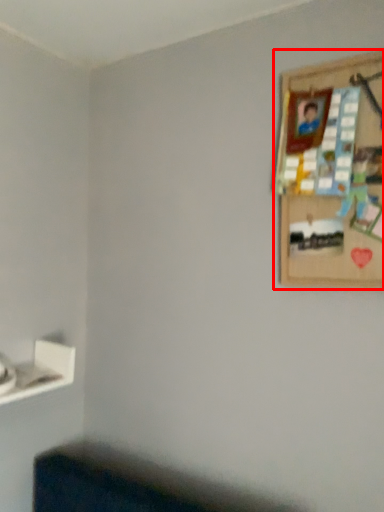
Question: Considering the relative positions of picture frame (annotated by the red box) and shelf in the image provided, where is picture frame (annotated by the red box) located with respect to the staircase?

Choices:
 (A) right
 (B) left

Answer: (A)